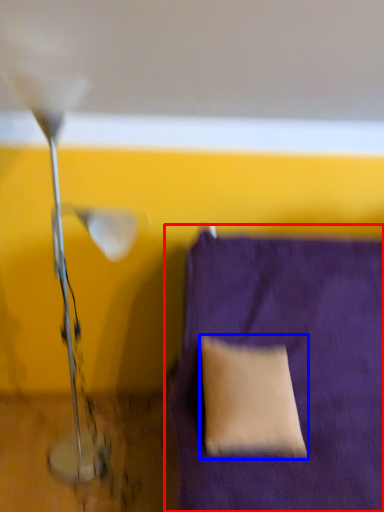
Question: Which object appears farthest to the camera in this image, furniture (highlighted by a red box) or pillow (highlighted by a blue box)?

Choices:
 (A) furniture
 (B) pillow

Answer: (B)